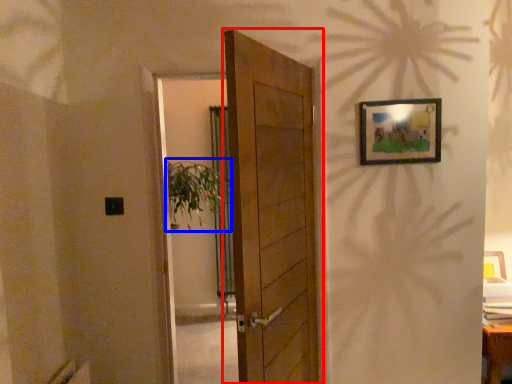
Question: Which point is further to the camera, door (highlighted by a red box) or plant (highlighted by a blue box)?

Choices:
 (A) door
 (B) plant

Answer: (B)